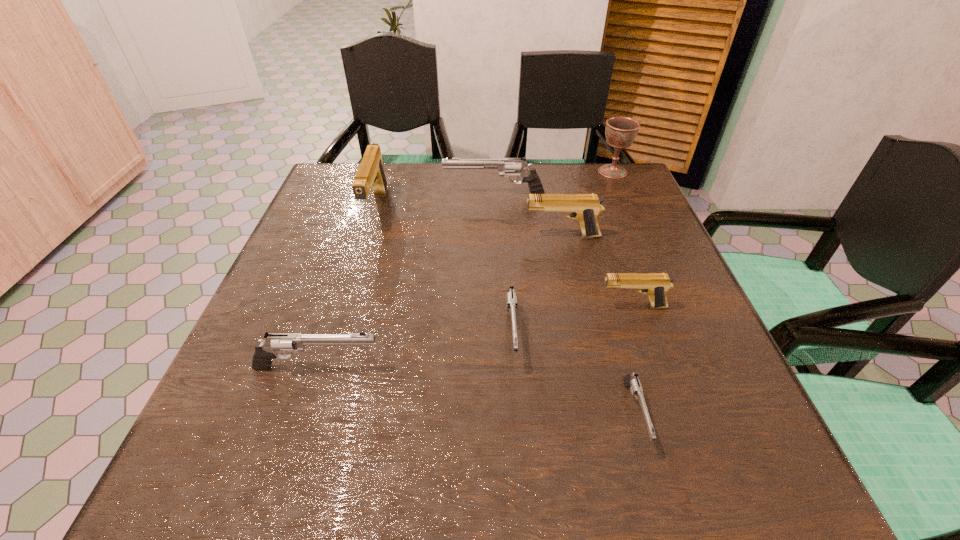
You are a GUI agent. You are given a task and a screenshot of the screen. Output one action in this format:
    pyautogui.click(x=<x>, y=<y>)
    Task: Click on the brown chalice
    The height and width of the screenshot is (540, 960).
    Given the screenshot: What is the action you would take?
    pyautogui.click(x=620, y=131)

The height and width of the screenshot is (540, 960). Find the location of `chalice`. chalice is located at coordinates [620, 131].

Where is `the leftmost tan pistol`? The height and width of the screenshot is (540, 960). the leftmost tan pistol is located at coordinates (370, 175).

At what (x,y) coordinates should I click in order to perform the action: click on the biggest tan pistol. Please return your answer as a coordinate pair (x, y). Looking at the image, I should click on (370, 175).

I want to click on the second biggest tan pistol, so click(x=585, y=208).

Where is `the biggest silver pistol`? the biggest silver pistol is located at coordinates (508, 167).

Image resolution: width=960 pixels, height=540 pixels. Find the location of `the third smallest silver pistol`. the third smallest silver pistol is located at coordinates (265, 351).

Identify the location of the nearest tan pistol. The image size is (960, 540). (656, 285).

Where is `the seventh tallest object`? the seventh tallest object is located at coordinates (511, 297).

Find the location of `the sixth tallest pistol`. the sixth tallest pistol is located at coordinates (511, 297).